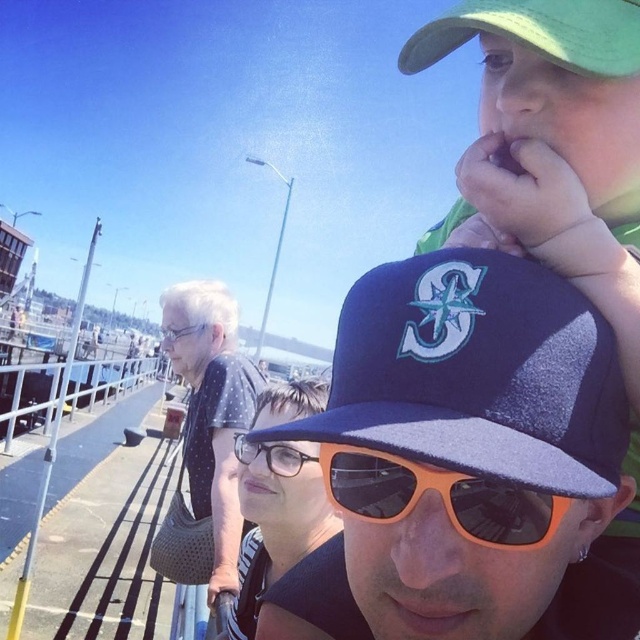
Question: Is navy blue mesh baseball cap at upper center closer to camera compared to green fabric baseball cap at upper right?

Choices:
 (A) yes
 (B) no

Answer: (A)

Question: Based on their relative distances, which object is farther from the silver metallic rail at lower left?

Choices:
 (A) clear plastic glasses at center
 (B) orange plastic sunglasses at center

Answer: (A)

Question: Does polka dot fabric shirt at center come behind green fabric baseball cap at upper right?

Choices:
 (A) no
 (B) yes

Answer: (B)

Question: Can you confirm if navy blue mesh baseball cap at upper center is wider than clear plastic glasses at center?

Choices:
 (A) yes
 (B) no

Answer: (A)

Question: Which of the following is the farthest from the observer?

Choices:
 (A) (51, 413)
 (B) (604, 68)
 (C) (216, 515)
 (D) (349, 397)

Answer: (A)

Question: Estimate the real-world distances between objects in this image. Which object is closer to the green fabric baseball cap at upper right?

Choices:
 (A) orange plastic sunglasses at center
 (B) silver metallic rail at lower left

Answer: (A)